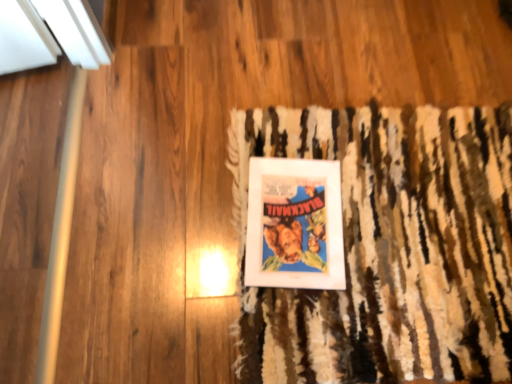
At what (x,y) coordinates should I click in order to perform the action: click on vacant space behind textured brown doormat at center. Please return your answer as a coordinate pair (x, y). This screenshot has height=384, width=512. Looking at the image, I should click on (348, 52).